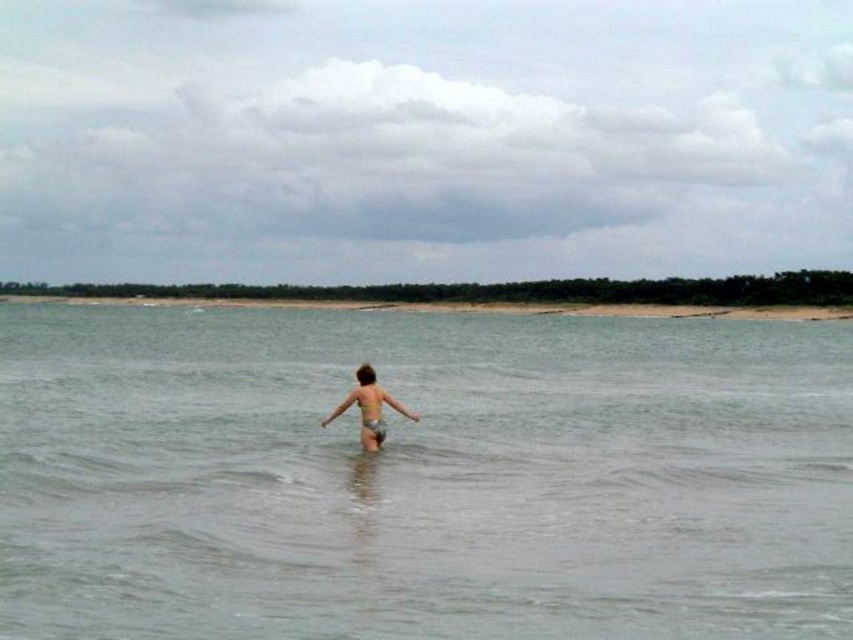
You are a lifeguard on duty at the beach. You notice a swimmer in the clear water at center and see their light brown skin at center. How far apart are the swimmer and the water surface where they are standing?

The distance between the clear water at center and the light brown skin at center is 8.88 meters, indicating the swimmer is 8.88 meters away from the water surface where they are standing.

You are a photographer trying to capture a shot of the light brown skin at center and the clear water at center. If you want to ensure both are fully visible in your frame, which object should you focus on first considering their widths?

The clear water at center has a greater width than the light brown skin at center, so you should focus on the clear water at center first to ensure it fits properly in the frame.